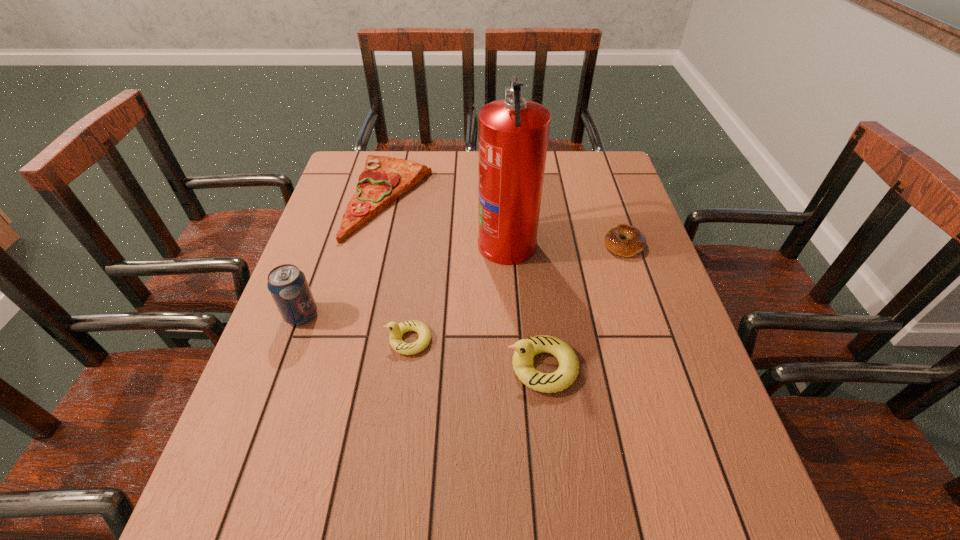
Where is `empty space that is in between the pizza and the pop soda`? Image resolution: width=960 pixels, height=540 pixels. empty space that is in between the pizza and the pop soda is located at coordinates (346, 257).

You are a GUI agent. You are given a task and a screenshot of the screen. Output one action in this format:
    pyautogui.click(x=<x>, y=<y>)
    Task: Click on the unoccupied area between the pop soda and the fire extinguisher
    The image size is (960, 540).
    Given the screenshot: What is the action you would take?
    pyautogui.click(x=404, y=279)

The image size is (960, 540). I want to click on vacant space that is in between the pop soda and the fire extinguisher, so click(404, 279).

At what (x,y) coordinates should I click in order to perform the action: click on free point between the shorter duckling and the taller duckling. Please return your answer as a coordinate pair (x, y). The image size is (960, 540). Looking at the image, I should click on (476, 354).

What are the coordinates of `empty space that is in between the shortest object and the fire extinguisher` in the screenshot? It's located at (565, 242).

Locate an element on the screen. The height and width of the screenshot is (540, 960). unoccupied position between the second tallest object and the fire extinguisher is located at coordinates (404, 279).

Where is `free area in between the fifth tallest object and the second tallest object`? The height and width of the screenshot is (540, 960). free area in between the fifth tallest object and the second tallest object is located at coordinates (346, 257).

The image size is (960, 540). What are the coordinates of `empty location between the rightmost object and the fourth shortest object` in the screenshot? It's located at (583, 305).

This screenshot has height=540, width=960. I want to click on empty space between the right duckling and the fire extinguisher, so click(524, 305).

Where is `vacant space in between the fire extinguisher and the fourth tallest object`? vacant space in between the fire extinguisher and the fourth tallest object is located at coordinates (458, 291).